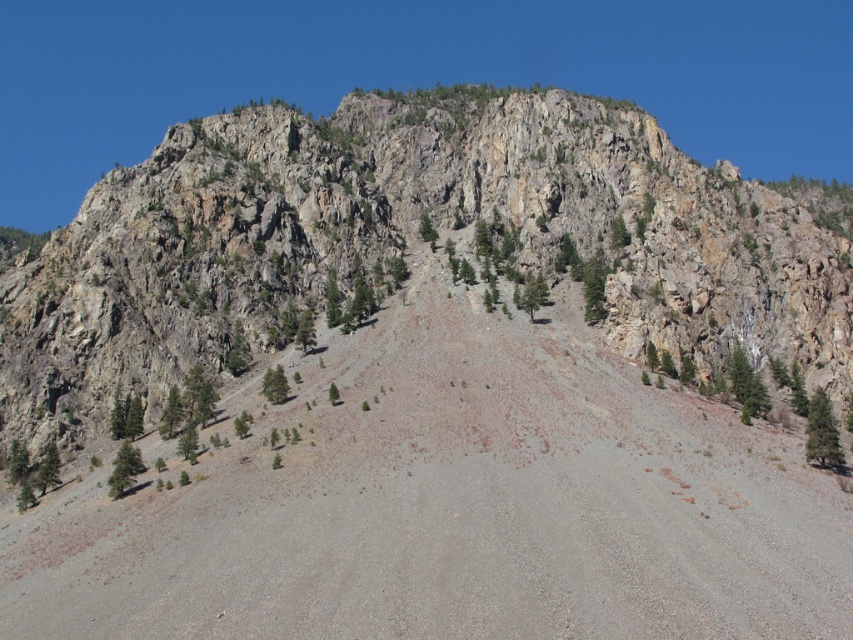
Between gray gravel dirt track at center and rocky cliff at upper center, which one is positioned higher?

rocky cliff at upper center is higher up.

Based on the photo, is the position of gray gravel dirt track at center less distant than that of rocky cliff at upper center?

Yes, gray gravel dirt track at center is closer to the viewer.

Is point (426, 401) behind point (738, 308)?

No, (426, 401) is closer to viewer.

The height and width of the screenshot is (640, 853). Identify the location of gray gravel dirt track at center. (447, 502).